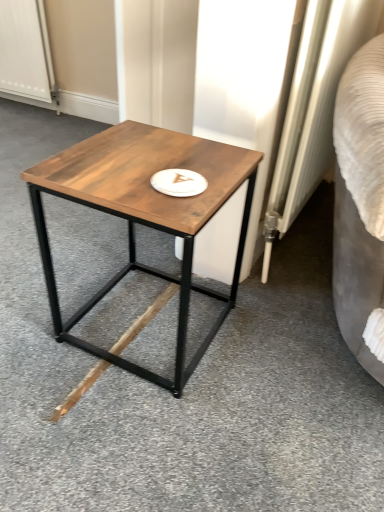
What is the approximate height of brown matte wood at center?

brown matte wood at center is 0.60 inches in height.

Image resolution: width=384 pixels, height=512 pixels. Identify the location of white textured radiator at right. (314, 106).

From the image's perspective, is brown matte wood at center over white textured screen door at upper left?

No, from the image's perspective, brown matte wood at center is not above white textured screen door at upper left.

Is brown matte wood at center aimed at white textured screen door at upper left?

No, brown matte wood at center is not oriented towards white textured screen door at upper left.

Is point (91, 384) closer to viewer compared to point (38, 91)?

Yes, point (91, 384) is closer to viewer.

The width and height of the screenshot is (384, 512). Find the location of `wood that is below the white textured screen door at upper left (from the image's perspective)`. wood that is below the white textured screen door at upper left (from the image's perspective) is located at coordinates (144, 319).

Is white matte platter at center a part of wooden table at center?

Yes, white matte platter at center is a part of wooden table at center.

Is point (72, 179) in front of point (158, 178)?

Yes, point (72, 179) is closer to viewer.

Is wooden table at center in contact with white matte platter at center?

No, wooden table at center is not touching white matte platter at center.

Identify the location of platter above the wooden table at center (from the image's perspective). (179, 183).

Measure the distance from white textured screen door at upper left to brown matte wood at center.

5.83 feet.

In the scene shown: From a real-world perspective, is white textured screen door at upper left on brown matte wood at center?

Correct, in the physical world, white textured screen door at upper left is higher than brown matte wood at center.

Is white textured screen door at upper left taller or shorter than brown matte wood at center?

Clearly, white textured screen door at upper left is taller compared to brown matte wood at center.

What's the angular difference between white textured screen door at upper left and brown matte wood at center's facing directions?

They differ by 0.779 degrees in their facing directions.

This screenshot has width=384, height=512. I want to click on platter positioned vertically above the white textured radiator at right (from a real-world perspective), so click(x=179, y=183).

Does white matte platter at center appear on the left side of white textured radiator at right?

Yes.

Would you say white matte platter at center contains white textured radiator at right?

No, white textured radiator at right is not inside white matte platter at center.

Would you say white textured radiator at right is inside or outside brown matte wood at center?

white textured radiator at right is not enclosed by brown matte wood at center.

Is white textured radiator at right further to the viewer compared to brown matte wood at center?

That is False.

Does white textured radiator at right appear on the right side of brown matte wood at center?

Indeed, white textured radiator at right is positioned on the right side of brown matte wood at center.

Which of these two, white textured radiator at right or brown matte wood at center, stands shorter?

With less height is brown matte wood at center.

You are a GUI agent. You are given a task and a screenshot of the screen. Output one action in this format:
    pyautogui.click(x=<x>, y=<y>)
    Task: Click on the screen door that appears above the white matte platter at center (from the image's perspective)
    The width and height of the screenshot is (384, 512).
    Given the screenshot: What is the action you would take?
    (26, 52)

Considering the positions of objects white matte platter at center and white textured screen door at upper left in the image provided, who is behind, white matte platter at center or white textured screen door at upper left?

white textured screen door at upper left is behind.

Considering the sizes of objects white matte platter at center and white textured screen door at upper left in the image provided, who is thinner, white matte platter at center or white textured screen door at upper left?

white matte platter at center.

Can you see white textured screen door at upper left touching white matte platter at center?

No.

From a real-world perspective, does white textured screen door at upper left stand above white matte platter at center?

No, from a real-world perspective, white textured screen door at upper left is not on top of white matte platter at center.

Relative to white matte platter at center, is white textured screen door at upper left in front or behind?

Clearly, white textured screen door at upper left is behind white matte platter at center.

Identify the location of screen door on the left of the brown matte wood at center. (26, 52).

The height and width of the screenshot is (512, 384). I want to click on coffee table that is under the white matte platter at center (from a real-world perspective), so click(144, 215).

Which object lies nearer to the anchor point wooden table at center, white textured screen door at upper left or white matte platter at center?

Among the two, white matte platter at center is located nearer to wooden table at center.

Estimate the real-world distances between objects in this image. Which object is closer to white textured screen door at upper left, white matte platter at center or wooden table at center?

wooden table at center.

Which object lies nearer to the anchor point white textured screen door at upper left, brown matte wood at center or wooden table at center?

Based on the image, wooden table at center appears to be nearer to white textured screen door at upper left.

From the picture: Which object lies further to the anchor point white textured screen door at upper left, white matte platter at center or white textured radiator at right?

Among the two, white matte platter at center is located further to white textured screen door at upper left.

Based on their spatial positions, is wooden table at center or white textured radiator at right further from white matte platter at center?

Based on the image, white textured radiator at right appears to be further to white matte platter at center.

Considering their positions, is white textured screen door at upper left positioned closer to white matte platter at center than wooden table at center?

Among the two, wooden table at center is located nearer to white matte platter at center.

Estimate the real-world distances between objects in this image. Which object is further from brown matte wood at center, white matte platter at center or white textured radiator at right?

Based on the image, white textured radiator at right appears to be further to brown matte wood at center.

When comparing their distances from white textured radiator at right, does brown matte wood at center or white matte platter at center seem closer?

The object closer to white textured radiator at right is white matte platter at center.

Image resolution: width=384 pixels, height=512 pixels. In order to click on platter positioned between wooden table at center and white textured screen door at upper left from near to far in this screenshot , I will do `click(179, 183)`.

At what (x,y) coordinates should I click in order to perform the action: click on platter that lies between white textured radiator at right and brown matte wood at center from top to bottom. Please return your answer as a coordinate pair (x, y). Looking at the image, I should click on (179, 183).

Identify the location of wood between white matte platter at center and white textured screen door at upper left in the front-back direction. (144, 319).

Locate an element on the screen. This screenshot has height=512, width=384. wood between wooden table at center and white textured screen door at upper left in the front-back direction is located at coordinates (144, 319).